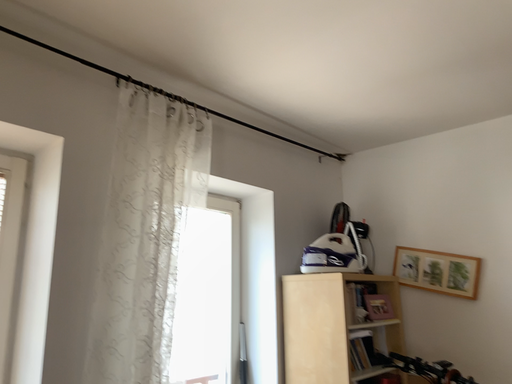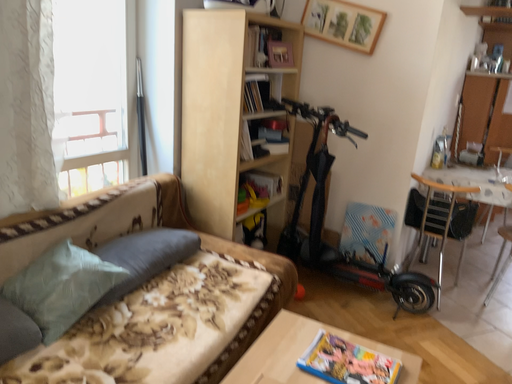
Question: Which way did the camera rotate in the video?

Choices:
 (A) rotated right
 (B) rotated left

Answer: (A)